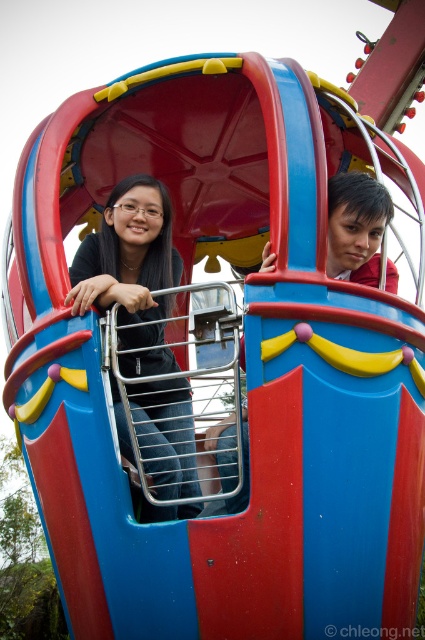
Question: Does matte black shirt at left have a lesser width compared to smooth red shirt at upper right?

Choices:
 (A) no
 (B) yes

Answer: (B)

Question: Is matte black shirt at left above smooth red shirt at upper right?

Choices:
 (A) no
 (B) yes

Answer: (A)

Question: Which of the following is the farthest from the observer?

Choices:
 (A) smooth red shirt at upper right
 (B) matte black shirt at left

Answer: (A)

Question: Does matte black shirt at left lie in front of smooth red shirt at upper right?

Choices:
 (A) yes
 (B) no

Answer: (A)

Question: Among these objects, which one is nearest to the camera?

Choices:
 (A) matte black shirt at left
 (B) smooth red shirt at upper right

Answer: (A)